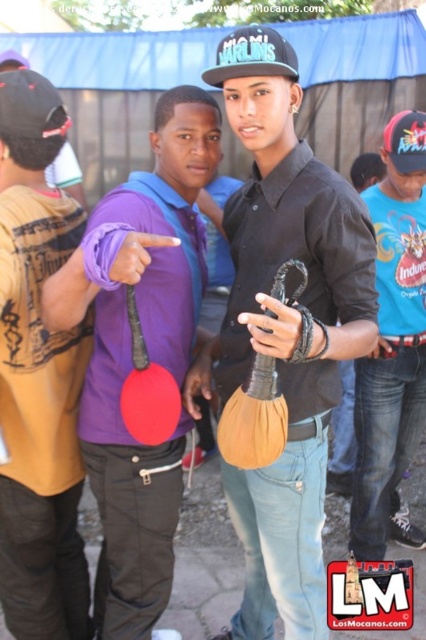
Looking at the scene, which object is positioned to the left of the other between the matte black shirt at center and the blue cotton shirt at right?

The matte black shirt at center is positioned to the left of the blue cotton shirt at right.

What is located at the coordinates point (284, 328)?

The coordinates point (284, 328) is occupied by the matte black shirt at center.